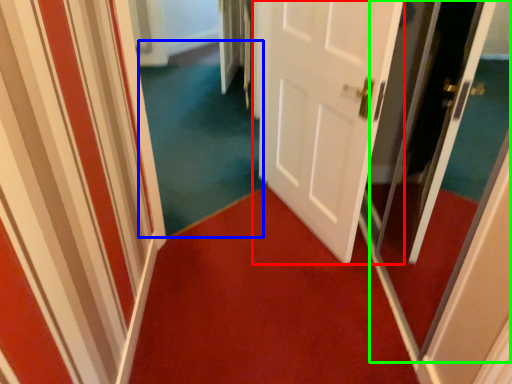
Question: Which is farther away from door (highlighted by a red box)? plain (highlighted by a blue box) or screen door (highlighted by a green box)?

Choices:
 (A) plain
 (B) screen door

Answer: (A)